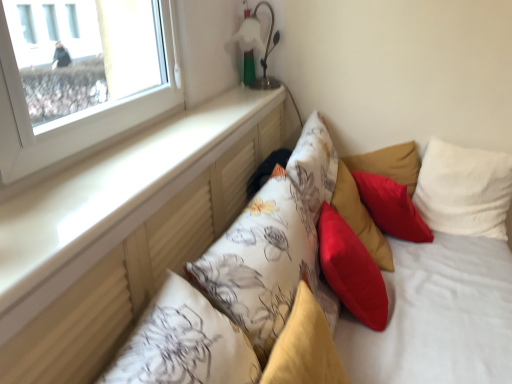
Question: From the image's perspective, is fluffy yellow pillow at center, which is counted as the 5th pillow, starting from the right, positioned above or below floral fabric pillow at center, which is the 6th pillow in right-to-left order?

Choices:
 (A) above
 (B) below

Answer: (B)

Question: Is fluffy yellow pillow at center, which is counted as the 5th pillow, starting from the right, to the left or to the right of floral fabric pillow at center, arranged as the 1th pillow when viewed from the left, in the image?

Choices:
 (A) right
 (B) left

Answer: (A)

Question: Which object is positioned farthest from the fluffy yellow pillow at center, which is counted as the 5th pillow, starting from the right?

Choices:
 (A) red matte pillow at upper right, which is the fifth pillow from left to right
 (B) smooth red cushion at center, positioned as the 4th pillow in right-to-left order
 (C) silky red cushion at center, the fourth pillow when ordered from left to right
 (D) white soft pillow at upper right, which is the sixth pillow from left to right
 (E) floral fabric pillow at center, which is the 6th pillow in right-to-left order

Answer: (D)

Question: Estimate the real-world distances between objects in this image. Which object is closer to the silky red cushion at center, which is the 3th pillow from right to left?

Choices:
 (A) metallic silver table lamp at upper center
 (B) smooth red cushion at center, positioned as the 4th pillow in right-to-left order
 (C) white matte window sill at upper left
 (D) fluffy yellow pillow at center, which is counted as the 5th pillow, starting from the right
 (E) white soft pillow at upper right, arranged as the first pillow when viewed from the right

Answer: (B)